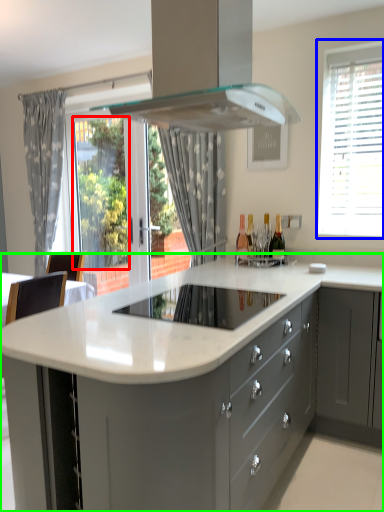
Question: Which is farther away from window screen (highlighted by a red box)? window (highlighted by a blue box) or countertop (highlighted by a green box)?

Choices:
 (A) window
 (B) countertop

Answer: (B)